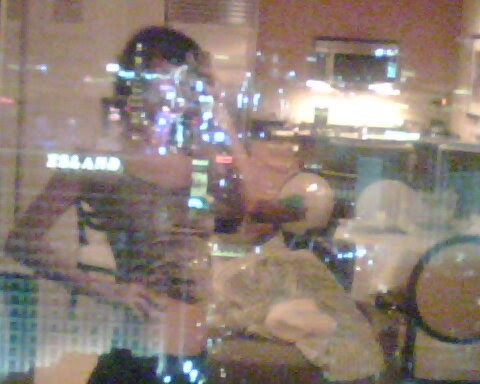
Find the location of `reflective transparent glass`. reflective transparent glass is located at coordinates (435, 96).